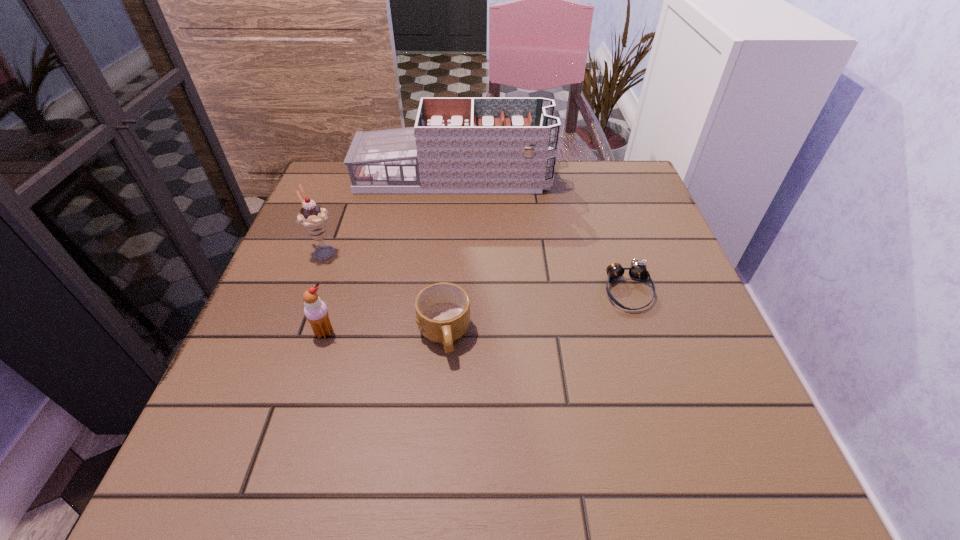
Identify the location of vacant region at the right edge of the desktop. (681, 418).

This screenshot has height=540, width=960. Find the location of `vacant region at the far left corner of the desktop`. vacant region at the far left corner of the desktop is located at coordinates (333, 208).

In the image, there is a desktop. At what (x,y) coordinates should I click in order to perform the action: click on vacant area at the near left corner. Please return your answer as a coordinate pair (x, y). Looking at the image, I should click on (293, 460).

Where is `vacant area at the far right corner of the desktop`? vacant area at the far right corner of the desktop is located at coordinates (577, 170).

Image resolution: width=960 pixels, height=540 pixels. Identify the location of free spot between the left icecream and the shortest object. (475, 272).

You are a GUI agent. You are given a task and a screenshot of the screen. Output one action in this format:
    pyautogui.click(x=<x>, y=<y>)
    Task: Click on the vacant region between the shorter icecream and the taller icecream
    
    Given the screenshot: What is the action you would take?
    pyautogui.click(x=324, y=292)

The image size is (960, 540). I want to click on free space between the second shortest object and the dollhouse, so click(x=448, y=256).

Locate an element on the screen. vacant space that is in between the right icecream and the dollhouse is located at coordinates (389, 255).

This screenshot has height=540, width=960. I want to click on unoccupied area between the left icecream and the nearer icecream, so (324, 292).

Where is `free point between the third tallest object and the second shortest object`? The width and height of the screenshot is (960, 540). free point between the third tallest object and the second shortest object is located at coordinates (384, 334).